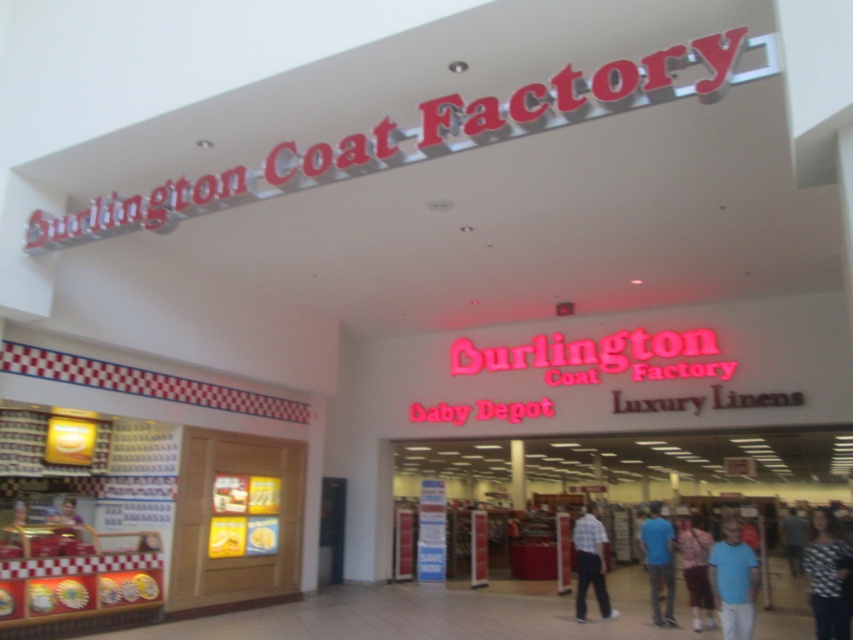
Question: Is patterned fabric shirt at lower right further to the viewer compared to blue cotton shirt at lower right?

Choices:
 (A) yes
 (B) no

Answer: (B)

Question: Which of the following is the closest to the observer?

Choices:
 (A) (793, 545)
 (B) (657, 612)
 (C) (596, 600)

Answer: (B)

Question: In this image, where is flannel shirt at center located relative to dark blue jeans at lower right?

Choices:
 (A) below
 (B) above

Answer: (B)

Question: Which of the following is the closest to the observer?

Choices:
 (A) patterned fabric shirt at lower right
 (B) dark blue jeans at lower right

Answer: (A)

Question: Which point is farther to the camera?

Choices:
 (A) patterned fabric shirt at lower right
 (B) blue cotton shirt at lower right
 (C) plaid shirt at center
 (D) dark blue jeans at lower right

Answer: (D)

Question: Is patterned fabric shirt at lower right to the right of plaid shirt at center from the viewer's perspective?

Choices:
 (A) yes
 (B) no

Answer: (A)